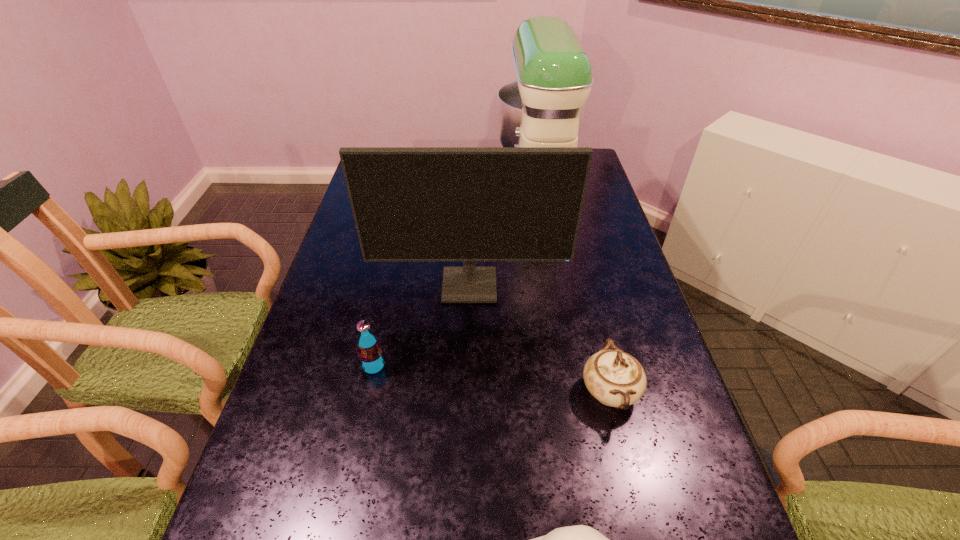
This screenshot has width=960, height=540. Identify the location of vacant space located on the back of the chinaware. (590, 313).

At what (x,y) coordinates should I click in order to perform the action: click on object present at the far edge. Please return your answer as a coordinate pair (x, y). This screenshot has width=960, height=540. Looking at the image, I should click on (545, 107).

Locate an element on the screen. This screenshot has height=540, width=960. computer monitor that is at the left edge is located at coordinates (469, 204).

Where is `soda that is at the left edge`? This screenshot has height=540, width=960. soda that is at the left edge is located at coordinates pyautogui.click(x=370, y=355).

Where is `mixer that is at the right edge`? The width and height of the screenshot is (960, 540). mixer that is at the right edge is located at coordinates (545, 107).

Locate an element on the screen. This screenshot has height=540, width=960. chinaware at the right edge is located at coordinates (615, 378).

Locate an element on the screen. The image size is (960, 540). object that is at the far right corner is located at coordinates (545, 107).

This screenshot has width=960, height=540. What are the coordinates of `vacant space at the left edge of the desktop` in the screenshot? It's located at (347, 222).

Image resolution: width=960 pixels, height=540 pixels. I want to click on free space at the right edge of the desktop, so click(638, 329).

The image size is (960, 540). Identify the location of free space between the soda and the chinaware. (492, 379).